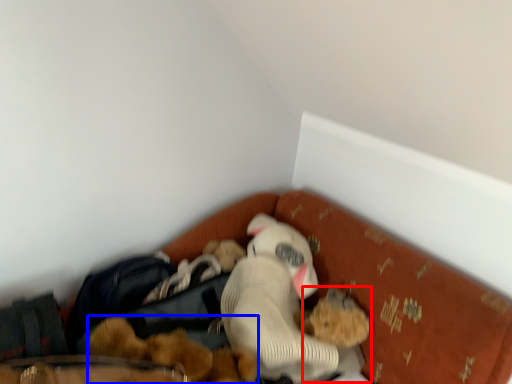
Question: Which object is closer to the camera taking this photo, toy (highlighted by a red box) or toy (highlighted by a blue box)?

Choices:
 (A) toy
 (B) toy

Answer: (B)